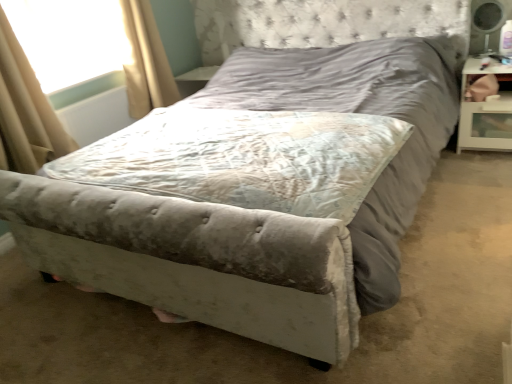
Question: Is transparent plastic window screen at upper left surrounding velvet gray mattress at center?

Choices:
 (A) yes
 (B) no

Answer: (B)

Question: Does transparent plastic window screen at upper left have a lesser height compared to velvet gray mattress at center?

Choices:
 (A) yes
 (B) no

Answer: (B)

Question: Is transparent plastic window screen at upper left facing away from velvet gray mattress at center?

Choices:
 (A) yes
 (B) no

Answer: (B)

Question: Considering the relative positions of transparent plastic window screen at upper left and velvet gray mattress at center in the image provided, is transparent plastic window screen at upper left to the left of velvet gray mattress at center from the viewer's perspective?

Choices:
 (A) no
 (B) yes

Answer: (B)

Question: From the image's perspective, is transparent plastic window screen at upper left located beneath velvet gray mattress at center?

Choices:
 (A) yes
 (B) no

Answer: (B)

Question: From the image's perspective, is beige fabric curtain at upper left, the second curtain from the left, positioned above or below beige fabric curtain at left, placed as the second curtain when sorted from right to left?

Choices:
 (A) below
 (B) above

Answer: (B)

Question: Relative to beige fabric curtain at left, which is counted as the second curtain, starting from the back, is beige fabric curtain at upper left, the second curtain from the left, in front or behind?

Choices:
 (A) behind
 (B) front

Answer: (A)

Question: Considering the positions of beige fabric curtain at upper left, the second curtain from the left, and beige fabric curtain at left, which is the 1th curtain in left-to-right order, in the image, is beige fabric curtain at upper left, the second curtain from the left, taller or shorter than beige fabric curtain at left, which is the 1th curtain in left-to-right order,?

Choices:
 (A) tall
 (B) short

Answer: (B)

Question: Is beige fabric curtain at upper left, the first curtain positioned from the right, wider or thinner than beige fabric curtain at left, placed as the second curtain when sorted from right to left?

Choices:
 (A) wide
 (B) thin

Answer: (A)

Question: Relative to transparent plastic window screen at upper left, is white glossy nightstand at right in front or behind?

Choices:
 (A) front
 (B) behind

Answer: (A)

Question: In terms of size, does white glossy nightstand at right appear bigger or smaller than transparent plastic window screen at upper left?

Choices:
 (A) big
 (B) small

Answer: (A)

Question: From their relative heights in the image, would you say white glossy nightstand at right is taller or shorter than transparent plastic window screen at upper left?

Choices:
 (A) tall
 (B) short

Answer: (B)

Question: From the image's perspective, relative to transparent plastic window screen at upper left, is white glossy nightstand at right above or below?

Choices:
 (A) above
 (B) below

Answer: (B)

Question: Is point coord(69,61) closer or farther from the camera than point coord(489,107)?

Choices:
 (A) closer
 (B) farther

Answer: (B)

Question: Looking at the image, does transparent plastic window screen at upper left seem bigger or smaller compared to white glossy nightstand at right?

Choices:
 (A) big
 (B) small

Answer: (B)